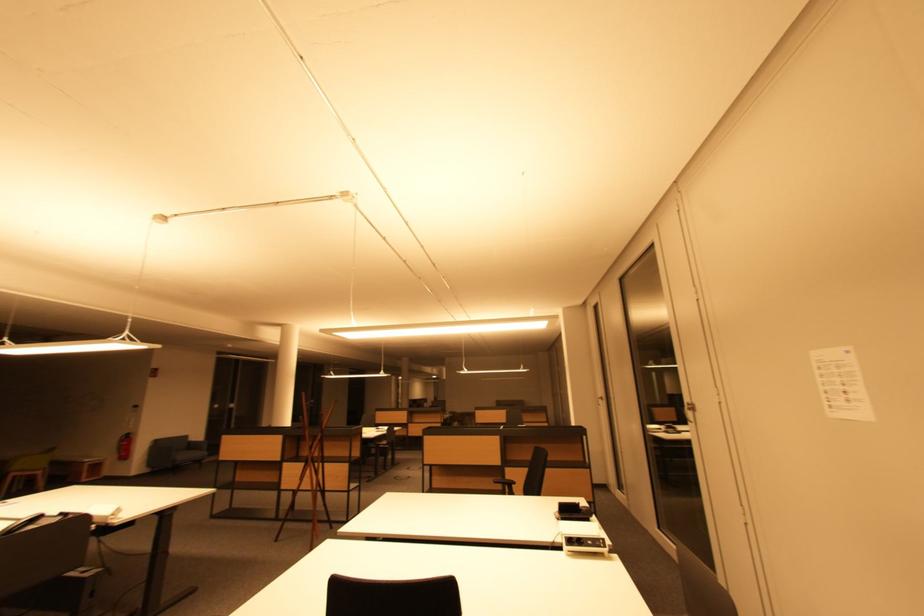
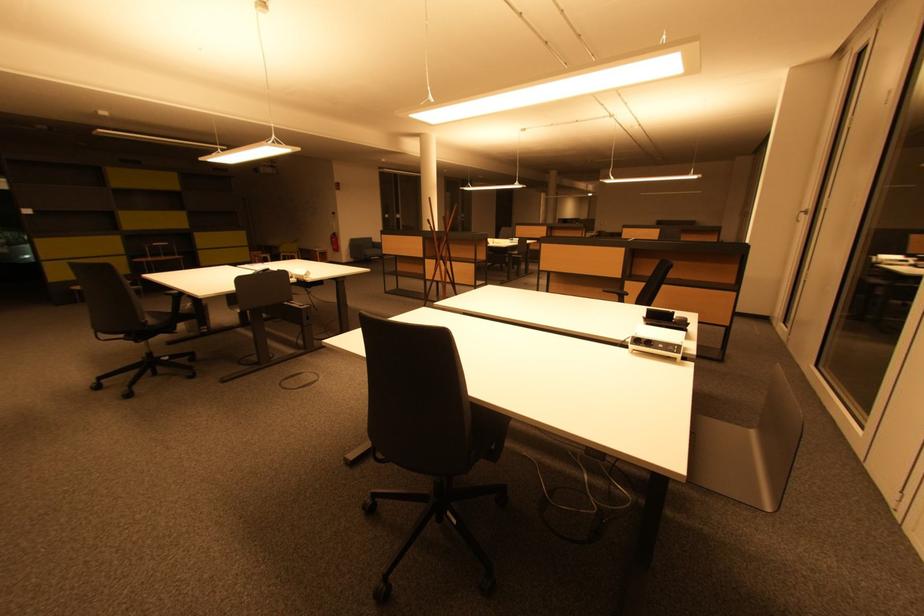
Locate, in the second image, the point that corresponds to the point at 128,445 in the first image.

(338, 241)